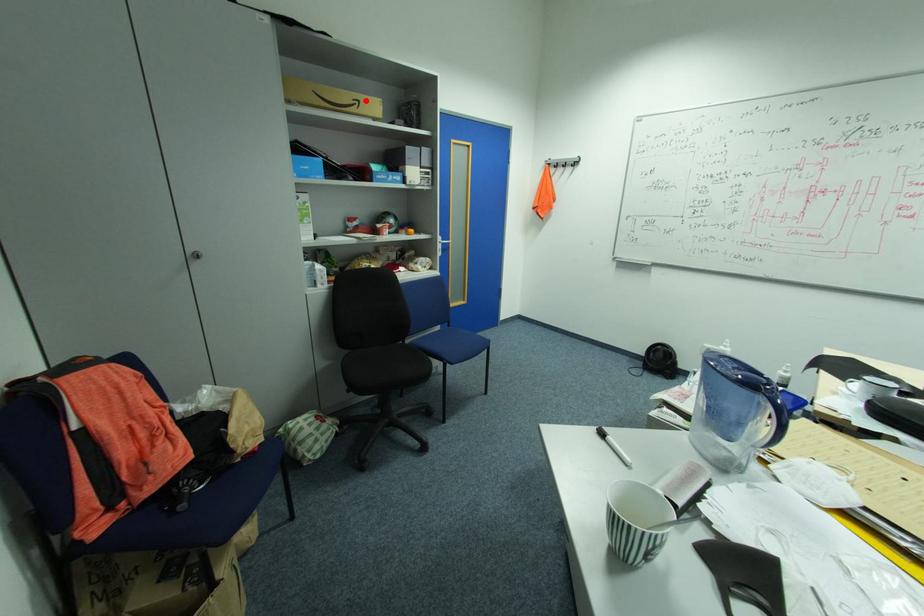
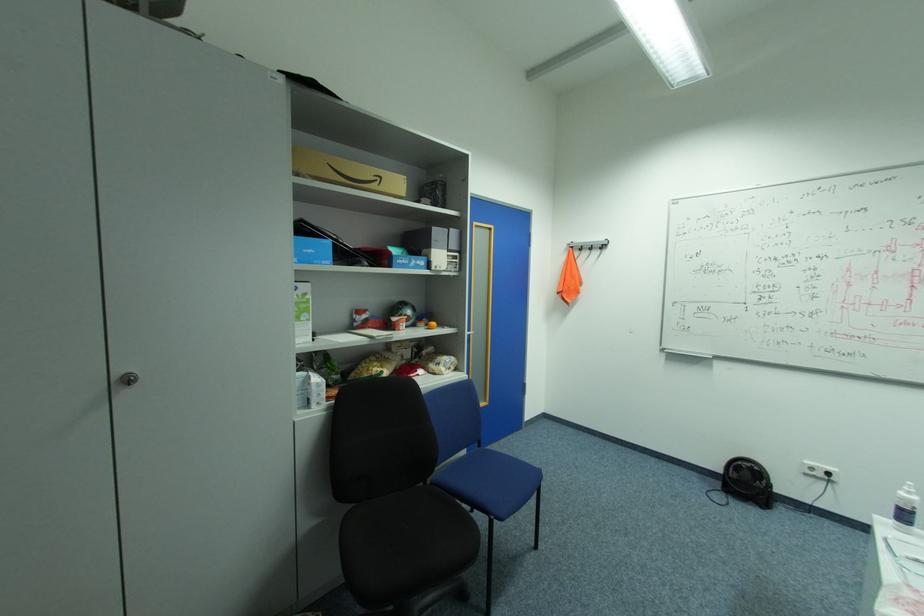
In the second image, find the point that corresponds to the highlighted location in the first image.

(386, 177)